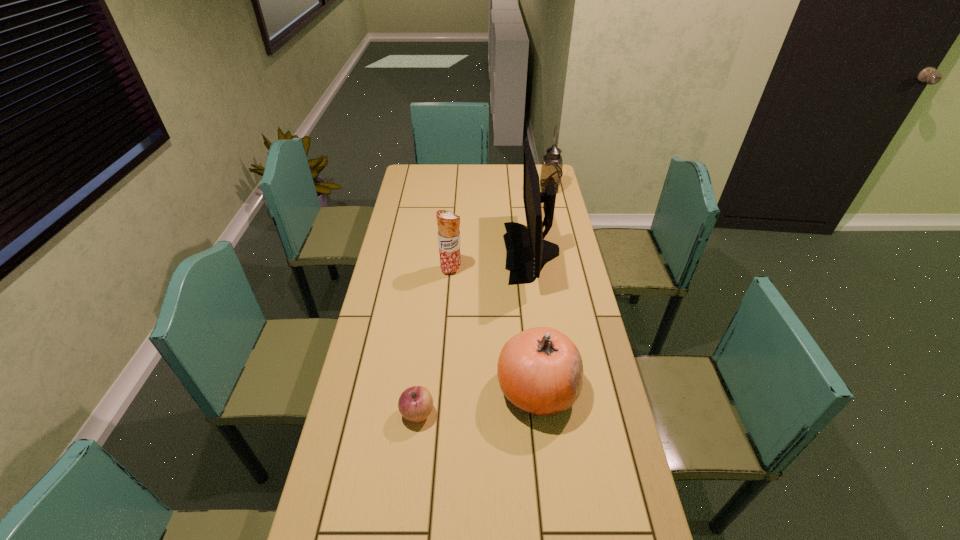
Locate an element on the screen. Image resolution: width=960 pixels, height=540 pixels. free space at the right edge of the desktop is located at coordinates (563, 253).

Locate an element on the screen. The width and height of the screenshot is (960, 540). unoccupied area between the monitor and the burrito is located at coordinates (492, 261).

The width and height of the screenshot is (960, 540). I want to click on unoccupied area between the burrito and the monitor, so click(x=492, y=261).

Image resolution: width=960 pixels, height=540 pixels. Identify the location of free spot between the monitor and the fourth tallest object. (535, 321).

Where is `vacant space that is in between the pumpkin and the burrito`? The height and width of the screenshot is (540, 960). vacant space that is in between the pumpkin and the burrito is located at coordinates (494, 329).

Locate an element on the screen. The height and width of the screenshot is (540, 960). free point between the oil lamp and the burrito is located at coordinates (500, 230).

Where is `object that is the fourth closest to the pumpkin`? This screenshot has width=960, height=540. object that is the fourth closest to the pumpkin is located at coordinates tap(551, 170).

Find the location of a particular element. the third closest object to the monitor is located at coordinates (540, 370).

Where is `free space that satisfies the following two spatial constraints: 1. on the back side of the farthest object; 2. on the left side of the burrito`? Image resolution: width=960 pixels, height=540 pixels. free space that satisfies the following two spatial constraints: 1. on the back side of the farthest object; 2. on the left side of the burrito is located at coordinates (457, 191).